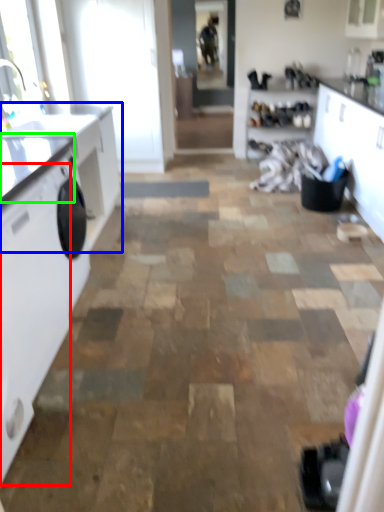
Question: Which object is positioned closest to washing machine (highlighted by a red box)? Select from countertop (highlighted by a blue box) and counter top (highlighted by a green box).

Choices:
 (A) countertop
 (B) counter top

Answer: (B)